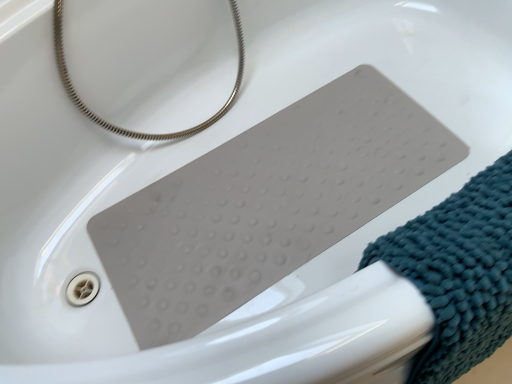
Question: Does silver metallic hose at upper left appear on the right side of teal textured towel at lower right?

Choices:
 (A) yes
 (B) no

Answer: (B)

Question: Does silver metallic hose at upper left have a smaller size compared to teal textured towel at lower right?

Choices:
 (A) no
 (B) yes

Answer: (A)

Question: From a real-world perspective, is silver metallic hose at upper left located beneath teal textured towel at lower right?

Choices:
 (A) yes
 (B) no

Answer: (B)

Question: Does silver metallic hose at upper left lie behind teal textured towel at lower right?

Choices:
 (A) no
 (B) yes

Answer: (B)

Question: Can you confirm if silver metallic hose at upper left is taller than teal textured towel at lower right?

Choices:
 (A) no
 (B) yes

Answer: (B)

Question: Does silver metallic hose at upper left have a larger size compared to teal textured towel at lower right?

Choices:
 (A) yes
 (B) no

Answer: (A)

Question: From a real-world perspective, is teal textured towel at lower right positioned under silver metallic hose at upper left based on gravity?

Choices:
 (A) yes
 (B) no

Answer: (A)

Question: From the image's perspective, is teal textured towel at lower right over silver metallic hose at upper left?

Choices:
 (A) no
 (B) yes

Answer: (A)

Question: Is teal textured towel at lower right outside of silver metallic hose at upper left?

Choices:
 (A) yes
 (B) no

Answer: (A)

Question: Can you confirm if teal textured towel at lower right is smaller than silver metallic hose at upper left?

Choices:
 (A) no
 (B) yes

Answer: (B)

Question: Does teal textured towel at lower right lie behind silver metallic hose at upper left?

Choices:
 (A) yes
 (B) no

Answer: (B)

Question: Considering the relative positions of teal textured towel at lower right and silver metallic hose at upper left in the image provided, is teal textured towel at lower right to the left of silver metallic hose at upper left from the viewer's perspective?

Choices:
 (A) yes
 (B) no

Answer: (B)

Question: Would you say teal textured towel at lower right is inside or outside silver metallic hose at upper left?

Choices:
 (A) outside
 (B) inside

Answer: (A)